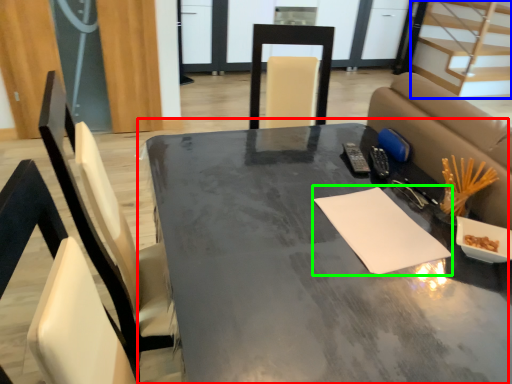
Question: Which is farther away from table (highlighted by a red box)? stairwell (highlighted by a blue box) or notepad (highlighted by a green box)?

Choices:
 (A) stairwell
 (B) notepad

Answer: (A)